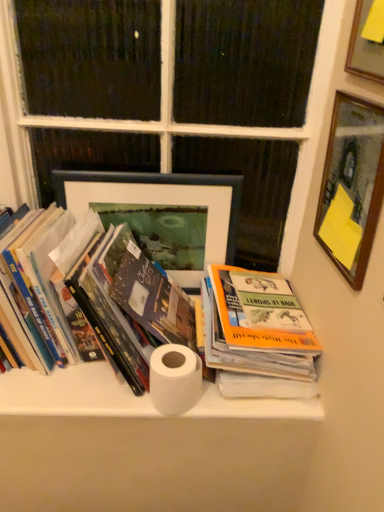
The image size is (384, 512). I want to click on vacant area on top of white paper towel at center (from a real-world perspective), so click(137, 388).